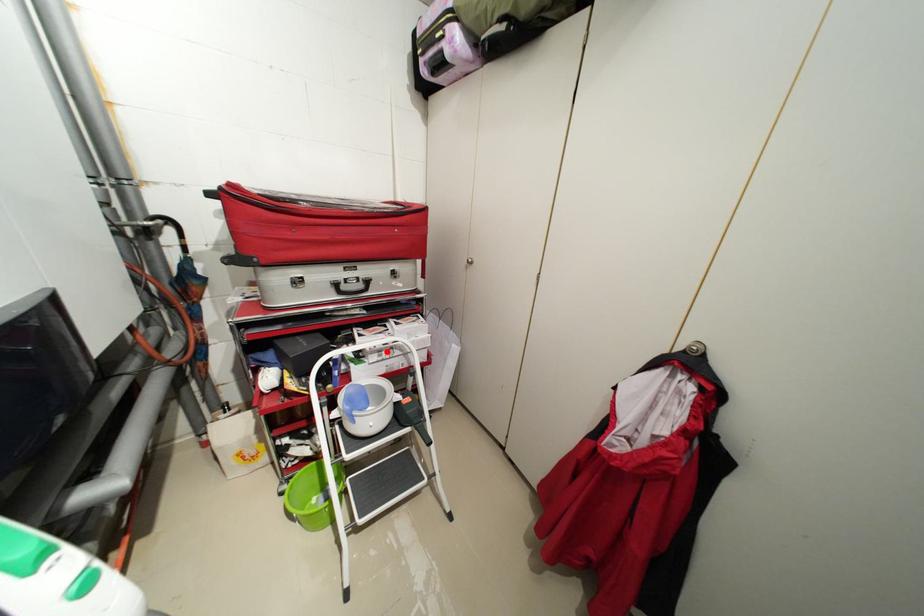
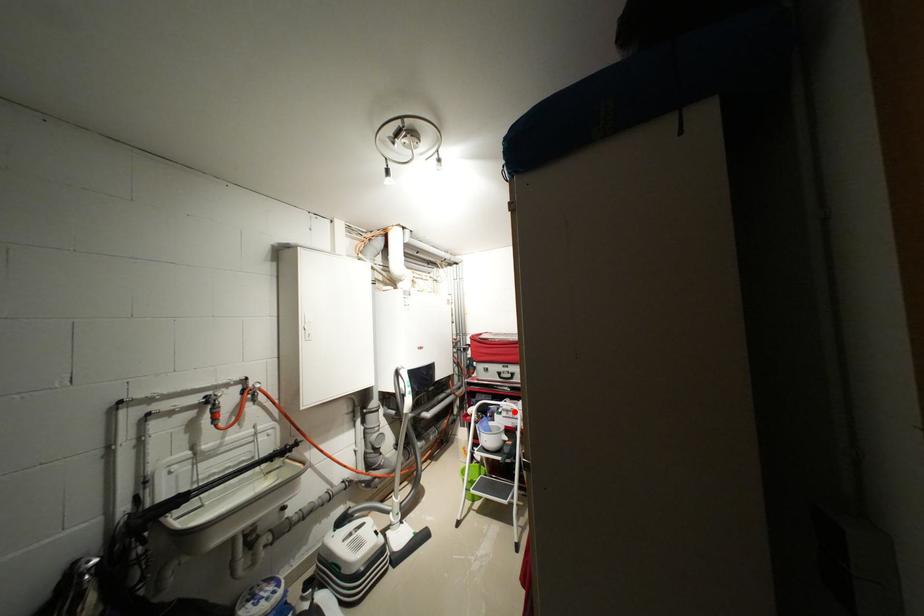
I am providing you with two images of the same scene from different viewpoints. A red point is marked on the first image and another point is marked on the second image. Do the highlighted points in image1 and image2 indicate the same real-world spot?

Yes